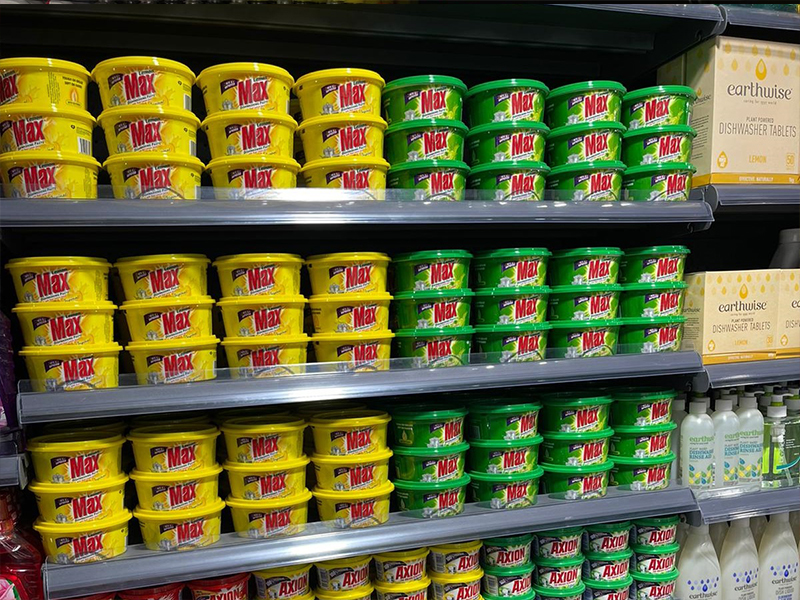
This screenshot has height=600, width=800. I want to click on bottom shelf, so click(412, 539).